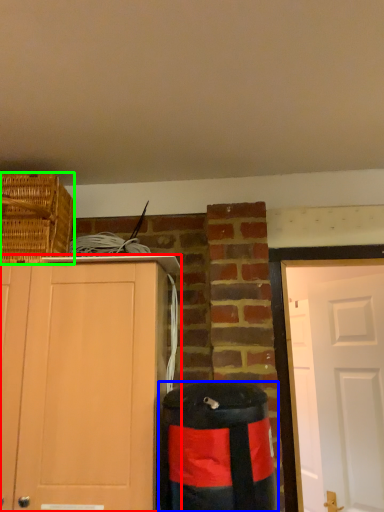
Question: Which is farther away from cabinetry (highlighted by a red box)? waste container (highlighted by a blue box) or basket (highlighted by a green box)?

Choices:
 (A) waste container
 (B) basket

Answer: (B)